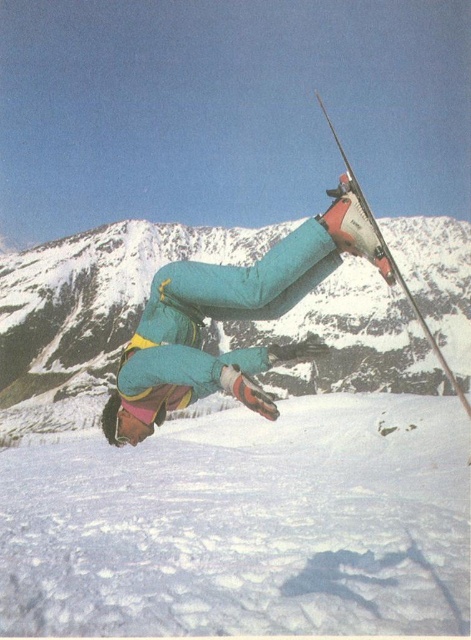
Is white powdery snow at lower center positioned behind teal matte snow pants at center?

Yes, white powdery snow at lower center is behind teal matte snow pants at center.

Who is positioned more to the right, white powdery snow at lower center or teal matte snow pants at center?

Positioned to the right is white powdery snow at lower center.

Which is behind, point (326, 531) or point (285, 301)?

Positioned behind is point (326, 531).

Image resolution: width=471 pixels, height=640 pixels. I want to click on white powdery snow at lower center, so click(x=244, y=525).

Between teal matte snow pants at center and matte red ski at upper right, which one has more height?

With more height is matte red ski at upper right.

Is teal matte snow pants at center positioned in front of matte red ski at upper right?

Yes, it is in front of matte red ski at upper right.

Identify the location of teal matte snow pants at center. (228, 317).

Is point (59, 561) positioned after point (321, 109)?

No, (59, 561) is in front of (321, 109).

You are a GUI agent. You are given a task and a screenshot of the screen. Output one action in this format:
    pyautogui.click(x=<x>, y=<y>)
    Task: Click on the white powdery snow at lower center
    The height and width of the screenshot is (640, 471).
    Given the screenshot: What is the action you would take?
    pyautogui.click(x=244, y=525)